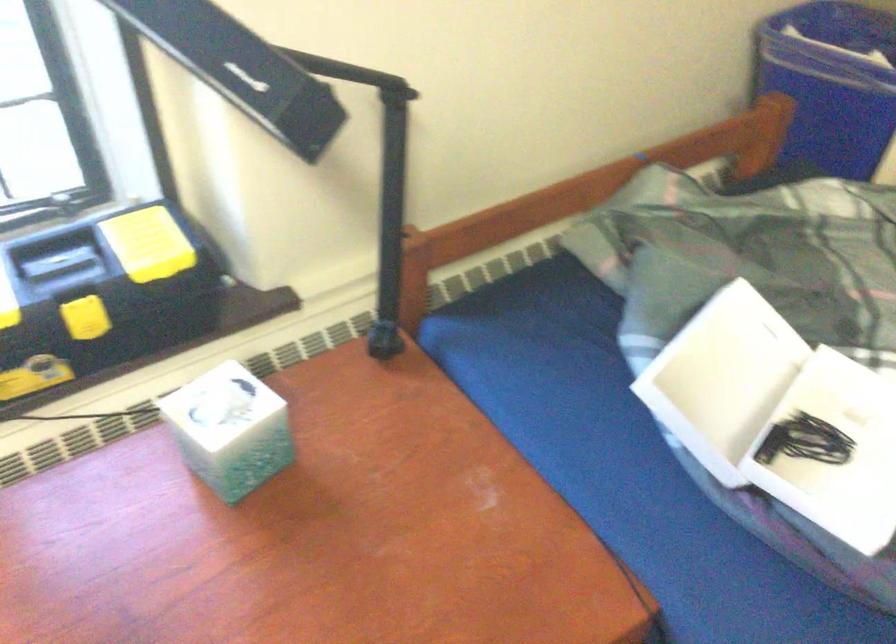
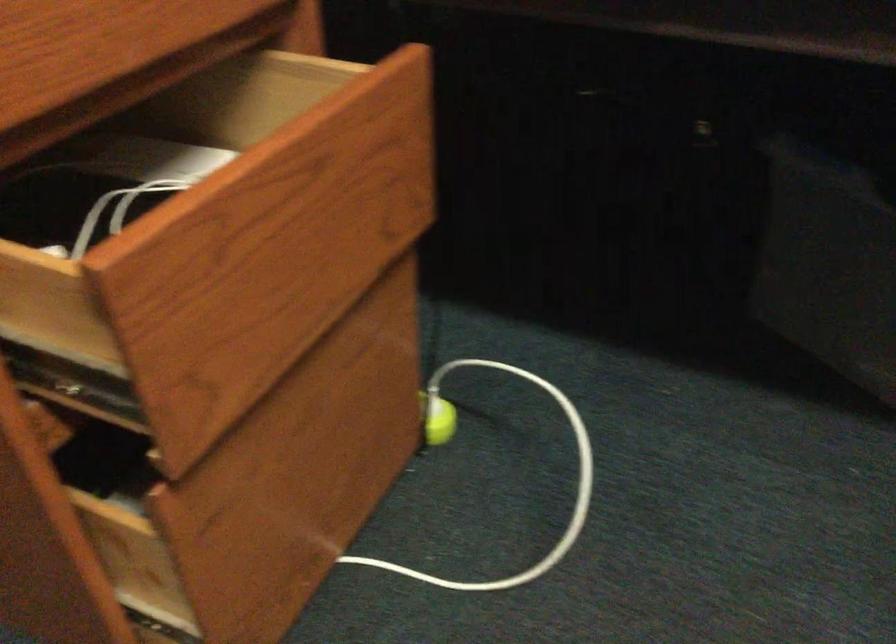
Question: The images are taken continuously from a first-person perspective. In which direction is your viewpoint rotating?

Choices:
 (A) Left
 (B) Right
 (C) Up
 (D) Down

Answer: (B)